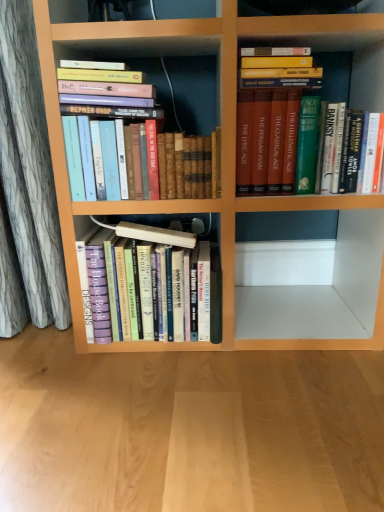
Question: From a real-world perspective, is green hardcover book at upper right, marked as the third book in a left-to-right arrangement, positioned above or below wooden floor at lower center?

Choices:
 (A) above
 (B) below

Answer: (A)

Question: Visually, is green hardcover book at upper right, the first book in the right-to-left sequence, positioned to the left or to the right of wooden floor at lower center?

Choices:
 (A) left
 (B) right

Answer: (B)

Question: Based on their relative distances, which object is farther from the hardcover books at center, arranged as the second book when viewed from the left?

Choices:
 (A) green hardcover book at upper right, marked as the third book in a left-to-right arrangement
 (B) hardcover books at upper left, the 1th book when ordered from left to right
 (C) wooden floor at lower center

Answer: (A)

Question: Estimate the real-world distances between objects in this image. Which object is closer to the hardcover books at upper left, the 1th book when ordered from left to right?

Choices:
 (A) hardcover books at center, which ranks as the 2th book in right-to-left order
 (B) green hardcover book at upper right, the first book in the right-to-left sequence
 (C) wooden floor at lower center

Answer: (B)